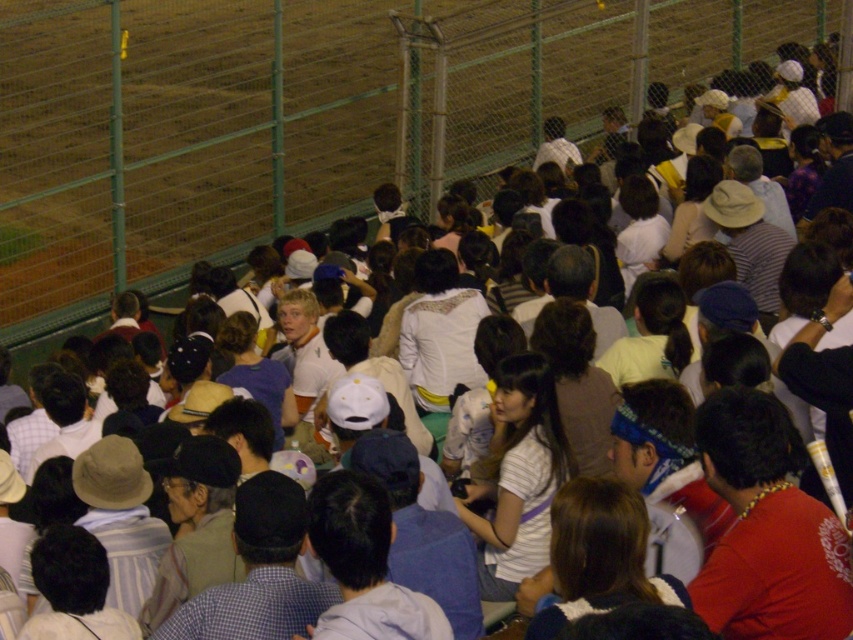
You are a photographer standing at the back of the crowd. You want to take a photo of both the red fabric shirt at center and the white striped shirt at center. Can you fit both of them in your camera frame if your camera has a minimum required distance of 1.5 meters between subjects to capture them clearly?

The distance between the red fabric shirt at center and the white striped shirt at center is 1.64 meters, which is greater than the camera requirement of 1.5 meters. Therefore, both subjects can be captured clearly in the photo.